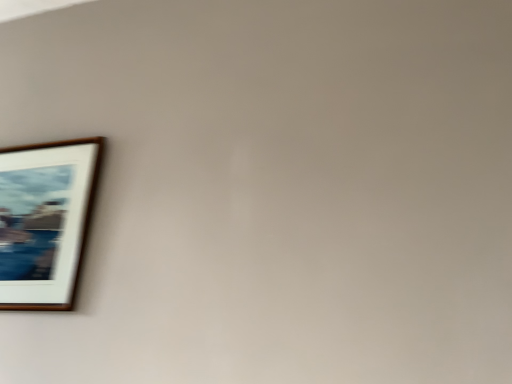
What is the approximate width of wooden frame at upper left?

1.15 inches.

Describe the element at coordinates (45, 221) in the screenshot. I see `wooden frame at upper left` at that location.

In order to face wooden frame at upper left, should I rotate leftwards or rightwards?

You should rotate left by 28.004 degrees.

This screenshot has height=384, width=512. What are the coordinates of `wooden frame at upper left` in the screenshot? It's located at (45, 221).

Locate an element on the screen. This screenshot has width=512, height=384. wooden frame at upper left is located at coordinates (45, 221).